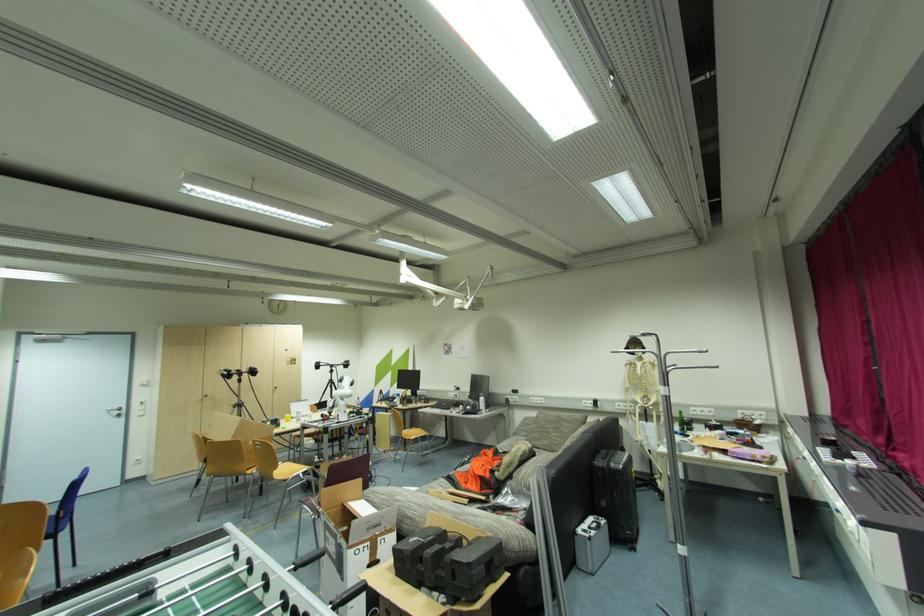
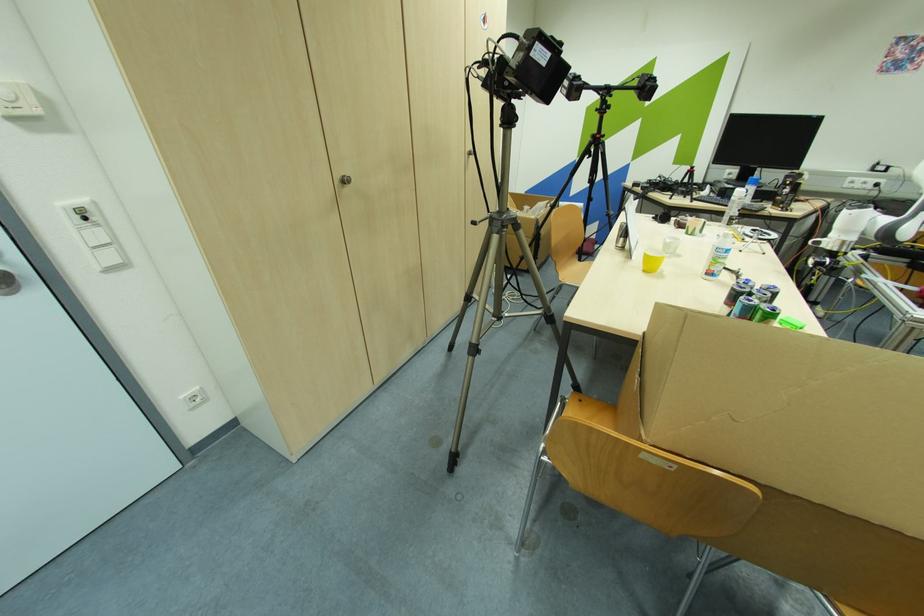
In the second image, find the point that corresponds to (x=210, y=397) in the first image.

(348, 182)